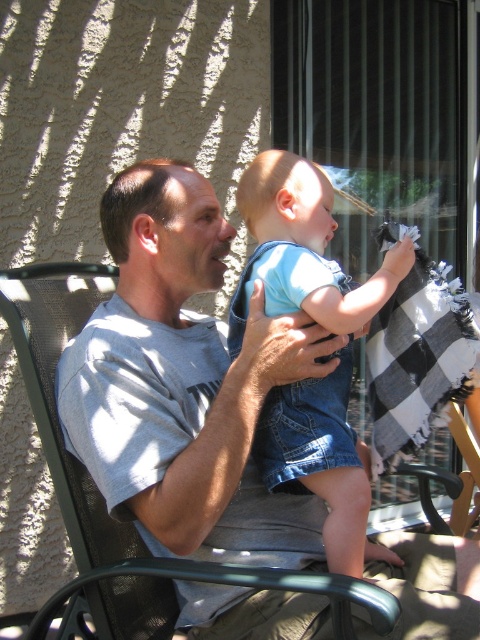
Is gray cotton t-shirt at center smaller than light blue denim shorts at center?

No.

Which is behind, point (364, 323) or point (310, 288)?

The point (364, 323) is more distant.

The height and width of the screenshot is (640, 480). I want to click on gray cotton t-shirt at center, so click(184, 384).